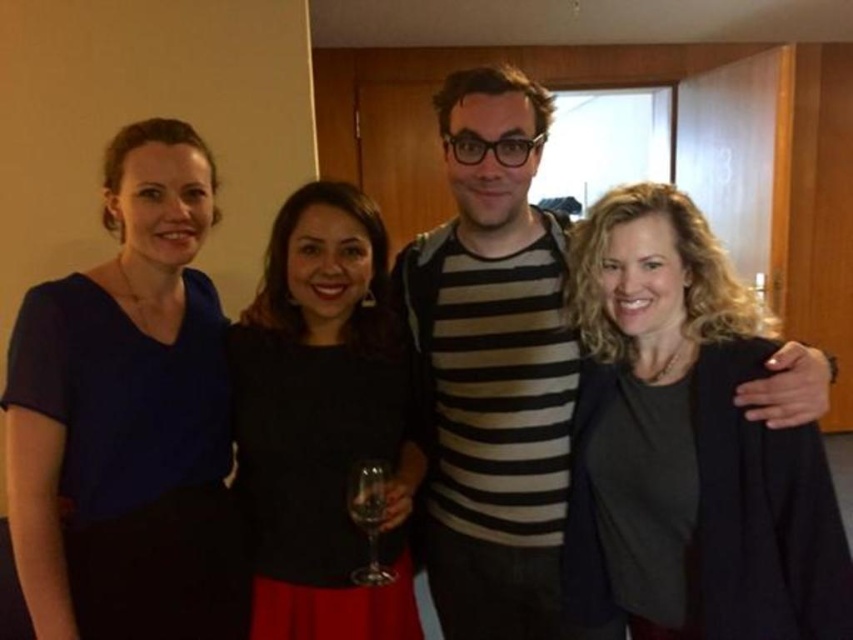
Question: Can you confirm if striped cotton shirt at center is positioned above transparent glass wine glass at center?

Choices:
 (A) no
 (B) yes

Answer: (B)

Question: Considering the relative positions of dark gray fabric at center and transparent glass at center in the image provided, where is dark gray fabric at center located with respect to transparent glass at center?

Choices:
 (A) above
 (B) below

Answer: (A)

Question: Which object appears closest to the camera in this image?

Choices:
 (A) striped cotton shirt at center
 (B) transparent glass wine glass at center
 (C) transparent glass at center

Answer: (C)

Question: Which is nearer to the dark gray fabric at center?

Choices:
 (A) blue matte dress at left
 (B) transparent glass at center
 (C) transparent glass wine glass at center

Answer: (C)

Question: Among these points, which one is nearest to the camera?

Choices:
 (A) 366,561
 (B) 619,612
 (C) 132,572

Answer: (C)

Question: Can you confirm if dark gray fabric at center is positioned above black matte dress at center?

Choices:
 (A) no
 (B) yes

Answer: (B)